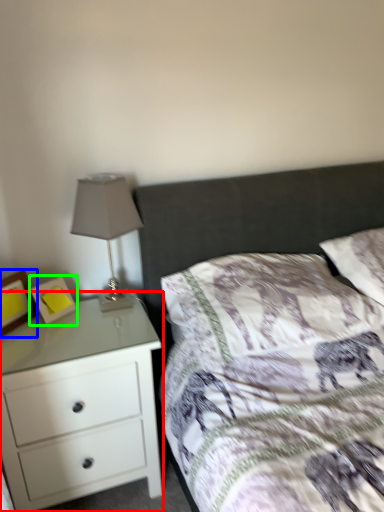
Question: Which object is positioned farthest from chest of drawers (highlighted by a red box)? Select from picture frame (highlighted by a blue box) and picture frame (highlighted by a green box).

Choices:
 (A) picture frame
 (B) picture frame

Answer: (A)